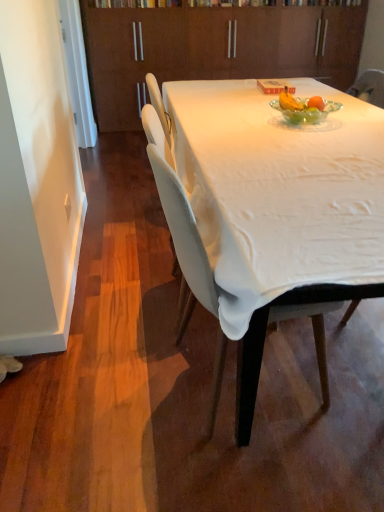
Where is `free space to the left of white fabric chair at center`? free space to the left of white fabric chair at center is located at coordinates (107, 387).